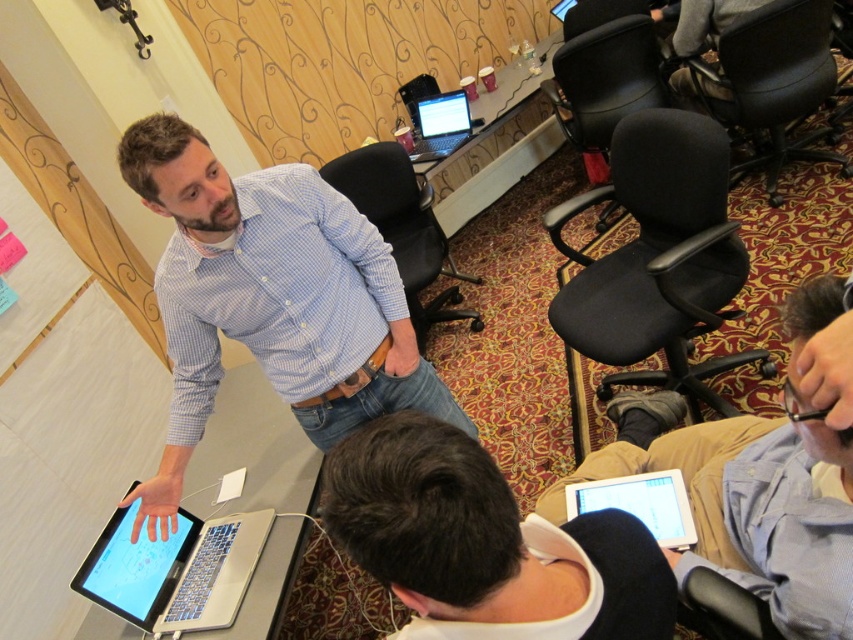
Locate an element on the screen. This screenshot has height=640, width=853. blue checkered shirt at center is located at coordinates (270, 300).

Which is below, blue checkered shirt at center or black leather chair at upper right?

Positioned lower is blue checkered shirt at center.

Who is more distant from viewer, (177, 189) or (776, 160)?

The point (776, 160) is more distant.

Where is `blue checkered shirt at center`? The width and height of the screenshot is (853, 640). blue checkered shirt at center is located at coordinates (270, 300).

Based on the photo, is silver metallic laptop at lower left taller than white matte tablet at lower center?

Correct, silver metallic laptop at lower left is much taller as white matte tablet at lower center.

Can you confirm if silver metallic laptop at lower left is wider than white matte tablet at lower center?

Correct, the width of silver metallic laptop at lower left exceeds that of white matte tablet at lower center.

Is point (111, 602) more distant than point (606, 504)?

Yes, point (111, 602) is behind point (606, 504).

Find the location of a particular element. Image resolution: width=853 pixels, height=640 pixels. silver metallic laptop at lower left is located at coordinates (173, 570).

Is point (840, 577) positioned after point (608, 483)?

No, (840, 577) is closer to viewer.

Is point (769, 424) positioned before point (613, 502)?

Yes.

Where is `blue shirt at upper center`? The width and height of the screenshot is (853, 640). blue shirt at upper center is located at coordinates (746, 502).